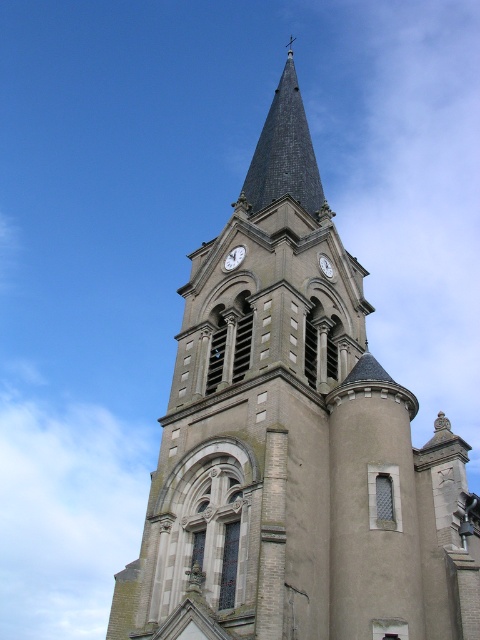
Question: Does smooth stone clock tower at center have a smaller size compared to white stone clock at upper center?

Choices:
 (A) no
 (B) yes

Answer: (A)

Question: Which point is closer to the camera?

Choices:
 (A) smooth stone clock tower at center
 (B) white metallic clock at center

Answer: (A)

Question: Can you confirm if smooth stone clock tower at center is thinner than white metallic clock at center?

Choices:
 (A) yes
 (B) no

Answer: (B)

Question: Considering the real-world distances, which object is closest to the white stone clock at upper center?

Choices:
 (A) smooth stone clock tower at center
 (B) white metallic clock at center

Answer: (B)

Question: Considering the real-world distances, which object is farthest from the smooth stone clock tower at center?

Choices:
 (A) white stone clock at upper center
 (B) white metallic clock at center

Answer: (B)

Question: Can you confirm if white stone clock at upper center is positioned to the right of white metallic clock at center?

Choices:
 (A) yes
 (B) no

Answer: (B)